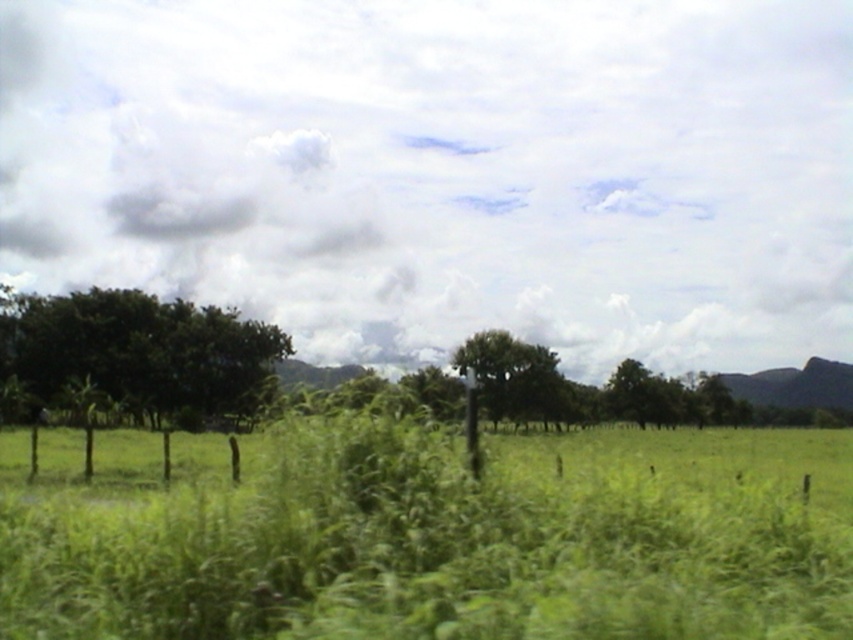
Question: Which object is closer to the camera taking this photo?

Choices:
 (A) green leafy tree at left
 (B) green grass at center
 (C) green leafy tree at center

Answer: (B)

Question: Estimate the real-world distances between objects in this image. Which object is farther from the green leafy tree at left?

Choices:
 (A) green grass at center
 (B) green leafy tree at center

Answer: (A)

Question: Which object is the farthest from the green leafy tree at left?

Choices:
 (A) green grass at center
 (B) green leafy tree at center

Answer: (A)

Question: Does green grass at center lie in front of green leafy tree at left?

Choices:
 (A) no
 (B) yes

Answer: (B)

Question: Does green grass at center appear over green leafy tree at center?

Choices:
 (A) no
 (B) yes

Answer: (A)

Question: Is green leafy tree at left smaller than green leafy tree at center?

Choices:
 (A) yes
 (B) no

Answer: (B)